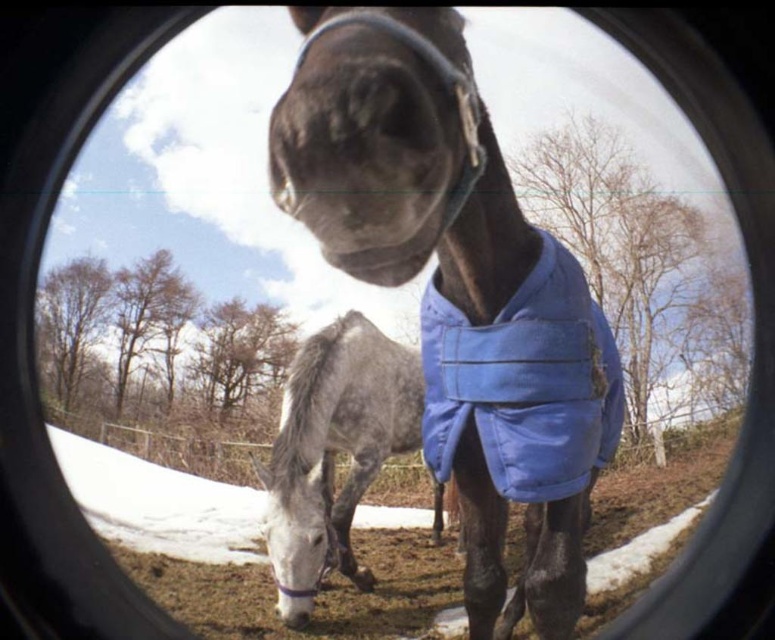
Looking at this image, you are a photographer adjusting your camera lens to focus on the scene. You notice the blue fabric at center and the gray speckled coat at center. Which object is closer to the camera lens?

The blue fabric at center is above the gray speckled coat at center, so it is closer to the camera lens.

You are a photographer trying to capture the two horses through the lens. Since the shiny blue blanket at center and the gray speckled coat at center are both in your view, which one do you think is closer to the camera?

The shiny blue blanket at center is closer to the camera because it is in front of the gray speckled coat at center.